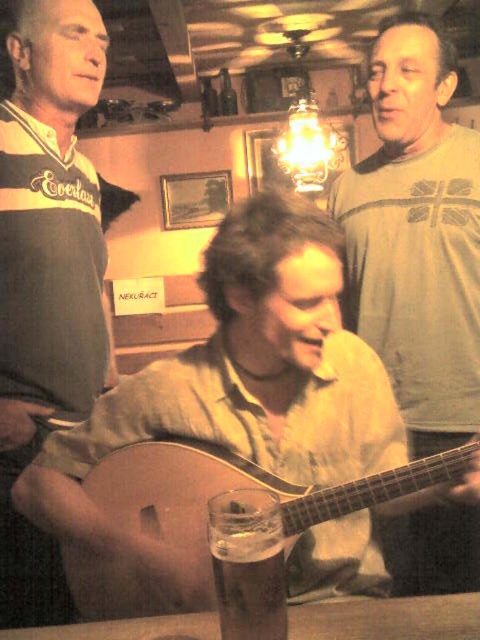
You are a bartender who needs to place a new drink order on the table between the matte brown guitar at center and the dark gray jersey at left. The drink order is 28 inches wide. Will it fit between them?

The distance between the matte brown guitar at center and the dark gray jersey at left is 29.66 inches. Since the drink order is 28 inches wide, it will fit with about 1.66 inches of space remaining.

In the scene shown: You are a photographer setting up a shot of the scene. You need to ensure that the matte brown guitar at center and the dark gray jersey at left are both in focus. Given that your camera can only focus on objects within a 1.2 meter width, will both objects fit within this focus range?

The matte brown guitar at center might be wider than dark gray jersey at left, so it is possible that the total width required to include both could exceed the camera focus range of 1.2 meters. However, without exact measurements, it is uncertain. The photographer should adjust the camera angle or position to ensure both are within the focus range.

Based on the photo, you are a photographer setting up a shoot in this scene. You need to position a spotlight so that it illuminates both the dark gray jersey at left and the light brown wooden guitar at center. Given their sizes, which object should you aim the spotlight at first to ensure proper coverage?

The dark gray jersey at left has a greater height compared to the light brown wooden guitar at center, so you should aim the spotlight at the dark gray jersey at left first to ensure proper coverage.